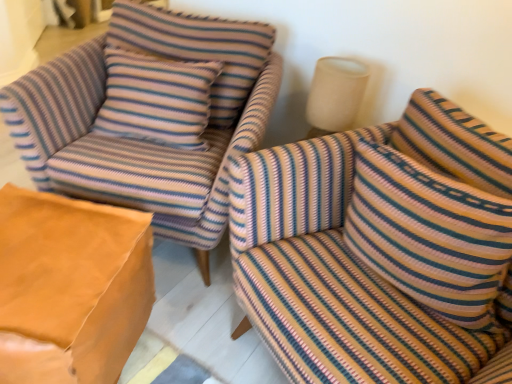
Question: Is striped fabric armchair at upper left beside striped fabric couch at right?

Choices:
 (A) yes
 (B) no

Answer: (B)

Question: From a real-world perspective, is striped fabric armchair at upper left over striped fabric couch at right?

Choices:
 (A) yes
 (B) no

Answer: (B)

Question: Considering the relative sizes of striped fabric armchair at upper left and striped fabric couch at right in the image provided, is striped fabric armchair at upper left shorter than striped fabric couch at right?

Choices:
 (A) yes
 (B) no

Answer: (B)

Question: Is striped fabric couch at right located within striped fabric armchair at upper left?

Choices:
 (A) no
 (B) yes

Answer: (A)

Question: Is striped fabric armchair at upper left facing towards striped fabric couch at right?

Choices:
 (A) no
 (B) yes

Answer: (A)

Question: In terms of size, does striped fabric couch at right appear bigger or smaller than striped fabric armchair at upper left?

Choices:
 (A) small
 (B) big

Answer: (A)

Question: Considering the positions of striped fabric couch at right and striped fabric armchair at upper left in the image, is striped fabric couch at right taller or shorter than striped fabric armchair at upper left?

Choices:
 (A) tall
 (B) short

Answer: (B)

Question: Visually, is striped fabric couch at right positioned to the left or to the right of striped fabric armchair at upper left?

Choices:
 (A) right
 (B) left

Answer: (A)

Question: Do you think striped fabric couch at right is within striped fabric armchair at upper left, or outside of it?

Choices:
 (A) outside
 (B) inside

Answer: (A)

Question: From the image's perspective, is striped fabric pillow at right positioned above or below striped fabric armchair at upper left?

Choices:
 (A) below
 (B) above

Answer: (A)

Question: From a real-world perspective, is striped fabric pillow at right positioned above or below striped fabric armchair at upper left?

Choices:
 (A) below
 (B) above

Answer: (B)

Question: Relative to striped fabric armchair at upper left, is striped fabric pillow at right in front or behind?

Choices:
 (A) behind
 (B) front

Answer: (B)

Question: Is striped fabric pillow at right inside the boundaries of striped fabric armchair at upper left, or outside?

Choices:
 (A) inside
 (B) outside

Answer: (B)

Question: In terms of height, does striped fabric armchair at upper left look taller or shorter compared to striped fabric pillow at right?

Choices:
 (A) short
 (B) tall

Answer: (B)

Question: From a real-world perspective, is striped fabric armchair at upper left physically located above or below striped fabric pillow at right?

Choices:
 (A) below
 (B) above

Answer: (A)